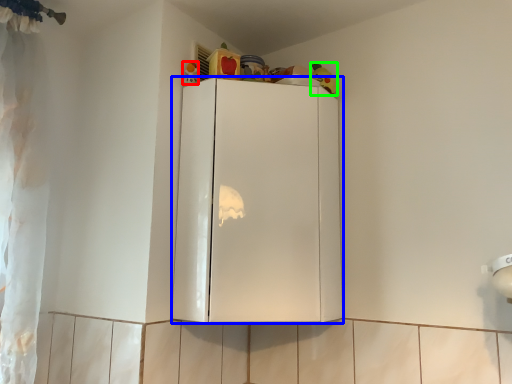
Question: Which is nearer to the toy (highlighted by a red box)? cabinetry (highlighted by a blue box) or toy (highlighted by a green box).

Choices:
 (A) cabinetry
 (B) toy

Answer: (B)